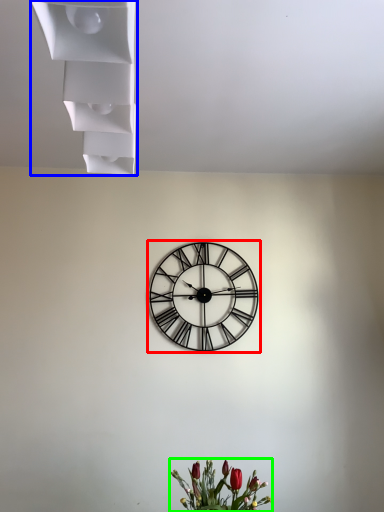
Question: Which object is the closest to the wall clock (highlighted by a red box)? Choose among these: shelf (highlighted by a blue box) or floral arrangement (highlighted by a green box).

Choices:
 (A) shelf
 (B) floral arrangement

Answer: (B)